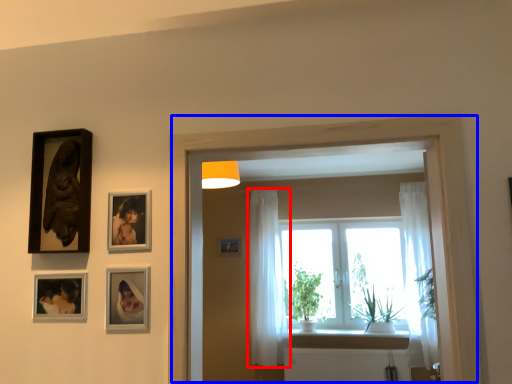
Question: Which object is further to the camera taking this photo, curtain (highlighted by a red box) or window frame (highlighted by a blue box)?

Choices:
 (A) curtain
 (B) window frame

Answer: (A)